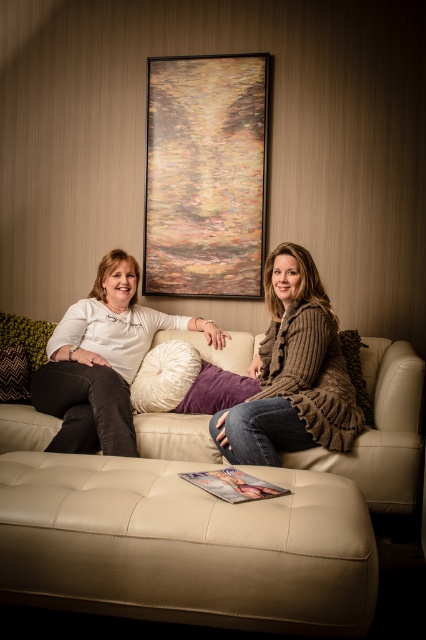
Does beige leather couch at center have a lesser height compared to matte white shirt at center?

Indeed, beige leather couch at center has a lesser height compared to matte white shirt at center.

From the picture: Which of these two, beige leather couch at center or matte white shirt at center, stands taller?

matte white shirt at center is taller.

You are a GUI agent. You are given a task and a screenshot of the screen. Output one action in this format:
    pyautogui.click(x=<x>, y=<y>)
    Task: Click on the beige leather couch at center
    
    Given the screenshot: What is the action you would take?
    pyautogui.click(x=382, y=432)

The height and width of the screenshot is (640, 426). Find the location of `beige leather couch at center`. beige leather couch at center is located at coordinates (382, 432).

Which is behind, point (405, 504) or point (238, 388)?

The point (238, 388) is behind.

Is beige leather couch at center shorter than purple velvet pillow at center?

In fact, beige leather couch at center may be taller than purple velvet pillow at center.

Between point (209, 458) and point (181, 403), which one is positioned in front?

Point (209, 458)

Locate an element on the screen. The image size is (426, 640). beige leather couch at center is located at coordinates (382, 432).

Is point (72, 332) behind point (196, 352)?

No, it is not.

Is matte white shirt at center thinner than white fluffy pillow at center?

No, matte white shirt at center is not thinner than white fluffy pillow at center.

Between point (210, 340) and point (147, 388), which one is positioned in front?

Point (147, 388) is more forward.

At what (x,y) coordinates should I click in order to perform the action: click on matte white shirt at center. Please return your answer as a coordinate pair (x, y). This screenshot has height=640, width=426. Looking at the image, I should click on click(x=103, y=360).